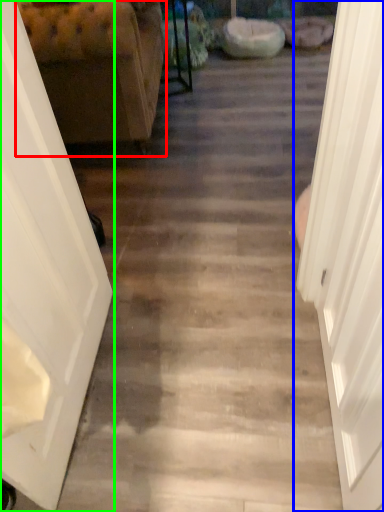
Question: Which object is the farthest from furniture (highlighted by a red box)? Choose among these: door (highlighted by a blue box) or door (highlighted by a green box).

Choices:
 (A) door
 (B) door

Answer: (A)